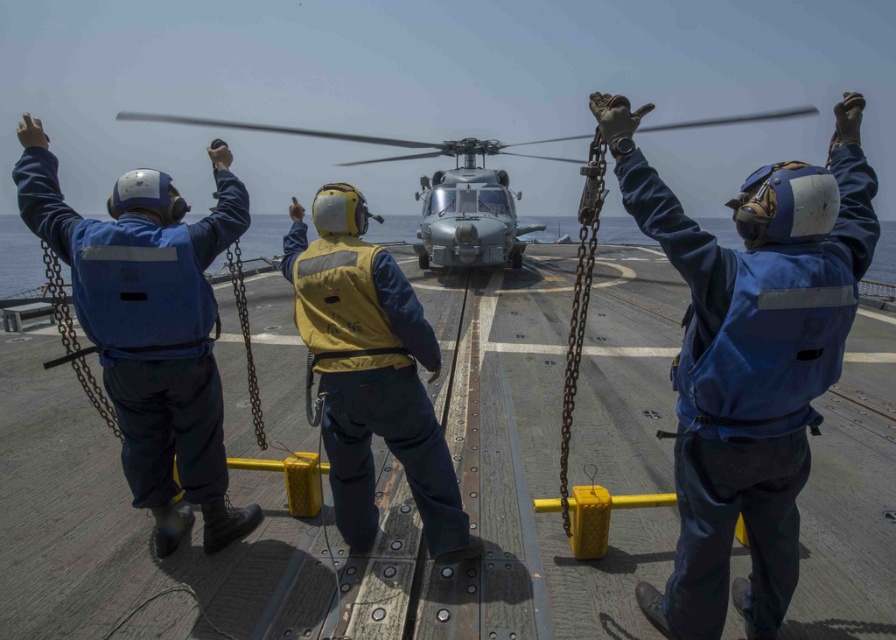
Does blue fabric helmet at upper left appear on the right side of yellow reflective vest at center?

No, blue fabric helmet at upper left is not to the right of yellow reflective vest at center.

Is blue fabric helmet at upper left to the left of yellow reflective vest at center from the viewer's perspective?

Yes, blue fabric helmet at upper left is to the left of yellow reflective vest at center.

Who is more distant from viewer, (177, 529) or (366, 444)?

The point (177, 529) is more distant.

You are a GUI agent. You are given a task and a screenshot of the screen. Output one action in this format:
    pyautogui.click(x=<x>, y=<y>)
    Task: Click on the blue fabric helmet at upper left
    This screenshot has height=640, width=896.
    Given the screenshot: What is the action you would take?
    pos(151,326)

Which of these two, yellow reflective vest at center or metallic gray helicopter at center, stands taller?

Standing taller between the two is metallic gray helicopter at center.

How distant is yellow reflective vest at center from metallic gray helicopter at center?

yellow reflective vest at center and metallic gray helicopter at center are 40.19 feet apart from each other.

The image size is (896, 640). Find the location of `yellow reflective vest at center`. yellow reflective vest at center is located at coordinates (369, 372).

Between point (858, 196) and point (328, 214), which one is positioned behind?

Positioned behind is point (328, 214).

Is blue fabric helmet at upper center thinner than yellow reflective vest at center?

No, blue fabric helmet at upper center is not thinner than yellow reflective vest at center.

Is point (772, 236) closer to camera compared to point (383, 269)?

Yes.

Where is `blue fabric helmet at upper center`? The width and height of the screenshot is (896, 640). blue fabric helmet at upper center is located at coordinates (748, 362).